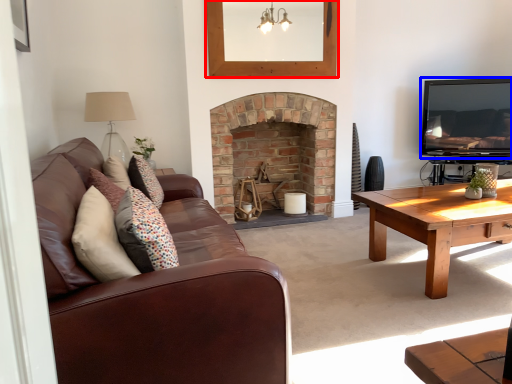
Question: Which object is closer to the camera taking this photo, picture frame (highlighted by a red box) or television (highlighted by a blue box)?

Choices:
 (A) picture frame
 (B) television

Answer: (A)